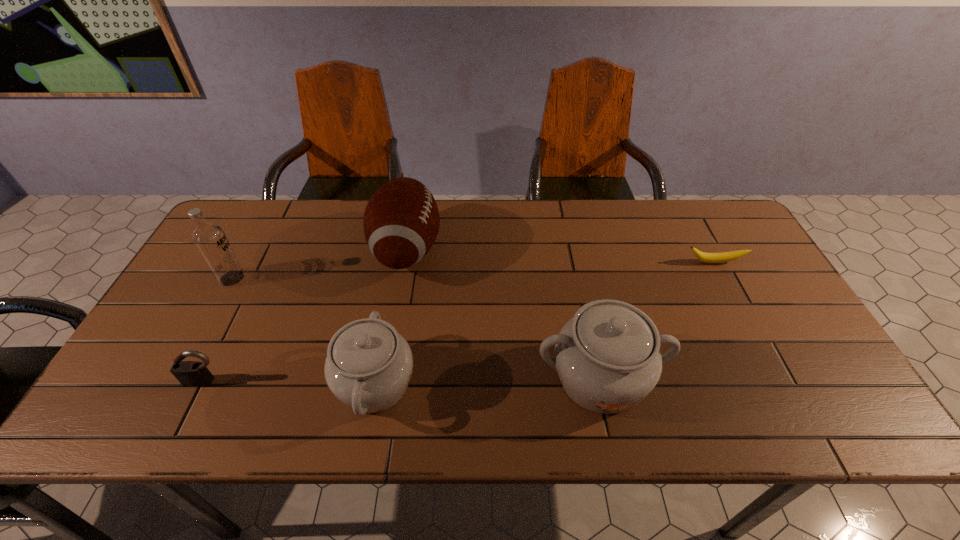
The width and height of the screenshot is (960, 540). In order to click on the fourth tallest object in this screenshot , I will do `click(368, 367)`.

Identify the location of the left chinaware. (368, 367).

At what (x,y) coordinates should I click in order to perform the action: click on the fifth object from left to right. Please return your answer as a coordinate pair (x, y). This screenshot has width=960, height=540. Looking at the image, I should click on (608, 358).

Where is `the right chinaware`? The height and width of the screenshot is (540, 960). the right chinaware is located at coordinates (608, 358).

This screenshot has width=960, height=540. I want to click on vodka, so click(209, 238).

Locate an element on the screen. Image resolution: width=960 pixels, height=540 pixels. football is located at coordinates (401, 221).

Identify the location of the shortest object. The width and height of the screenshot is (960, 540). (721, 257).

The image size is (960, 540). Identify the location of the rightmost object. (721, 257).

Identify the location of padlock. This screenshot has width=960, height=540. (189, 373).

Identify the location of free space located 0.380m on the left of the shorter chinaware. (171, 384).